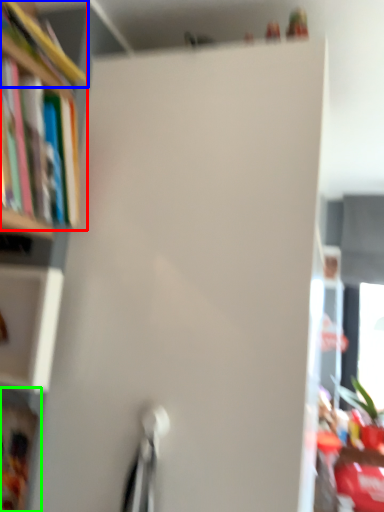
Question: Which is nearer to the book (highlighted by a red box)? book (highlighted by a blue box) or cabinet (highlighted by a green box).

Choices:
 (A) book
 (B) cabinet

Answer: (A)